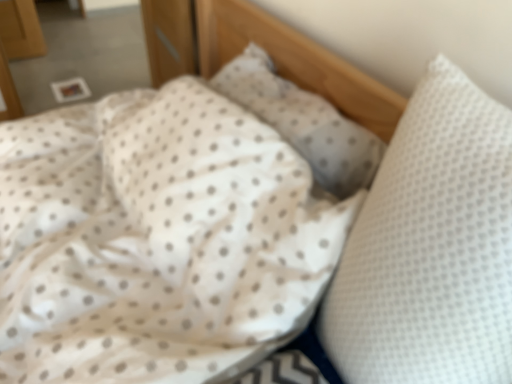
Question: Can you confirm if white dotted pillow at right, positioned as the 2th pillow in back-to-front order, is taller than white dotted pillow at center, positioned as the first pillow in back-to-front order?

Choices:
 (A) no
 (B) yes

Answer: (B)

Question: Is white dotted pillow at right, positioned as the 2th pillow in back-to-front order, smaller than white dotted pillow at center, the second pillow positioned from the front?

Choices:
 (A) no
 (B) yes

Answer: (A)

Question: From the image's perspective, is white dotted pillow at right, arranged as the first pillow when viewed from the front, over white dotted pillow at center, positioned as the first pillow in back-to-front order?

Choices:
 (A) yes
 (B) no

Answer: (B)

Question: Is white dotted pillow at right, arranged as the first pillow when viewed from the front, located outside white dotted pillow at center, positioned as the first pillow in back-to-front order?

Choices:
 (A) yes
 (B) no

Answer: (A)

Question: Is white dotted pillow at right, arranged as the first pillow when viewed from the front, oriented towards white dotted pillow at center, the second pillow positioned from the front?

Choices:
 (A) no
 (B) yes

Answer: (A)

Question: Can you confirm if white dotted pillow at right, arranged as the first pillow when viewed from the front, is thinner than white dotted pillow at center, the second pillow positioned from the front?

Choices:
 (A) yes
 (B) no

Answer: (B)

Question: Can you see white dotted pillow at center, the second pillow positioned from the front, touching white dotted pillow at right, positioned as the 2th pillow in back-to-front order?

Choices:
 (A) no
 (B) yes

Answer: (A)

Question: Considering the relative sizes of white dotted pillow at center, the second pillow positioned from the front, and white dotted pillow at right, arranged as the first pillow when viewed from the front, in the image provided, is white dotted pillow at center, the second pillow positioned from the front, shorter than white dotted pillow at right, arranged as the first pillow when viewed from the front,?

Choices:
 (A) yes
 (B) no

Answer: (A)

Question: Is the position of white dotted pillow at center, positioned as the first pillow in back-to-front order, more distant than that of white dotted pillow at right, positioned as the 2th pillow in back-to-front order?

Choices:
 (A) yes
 (B) no

Answer: (A)

Question: Can you confirm if white dotted pillow at center, positioned as the first pillow in back-to-front order, is positioned to the left of white dotted pillow at right, arranged as the first pillow when viewed from the front?

Choices:
 (A) yes
 (B) no

Answer: (A)

Question: Considering the relative sizes of white dotted pillow at center, positioned as the first pillow in back-to-front order, and white dotted pillow at right, arranged as the first pillow when viewed from the front, in the image provided, is white dotted pillow at center, positioned as the first pillow in back-to-front order, taller than white dotted pillow at right, arranged as the first pillow when viewed from the front,?

Choices:
 (A) yes
 (B) no

Answer: (B)

Question: From the image's perspective, is white dotted pillow at center, the second pillow positioned from the front, located above white dotted pillow at right, positioned as the 2th pillow in back-to-front order?

Choices:
 (A) no
 (B) yes

Answer: (B)

Question: Is white dotted pillow at center, the second pillow positioned from the front, inside or outside of white dotted pillow at right, positioned as the 2th pillow in back-to-front order?

Choices:
 (A) outside
 (B) inside

Answer: (A)